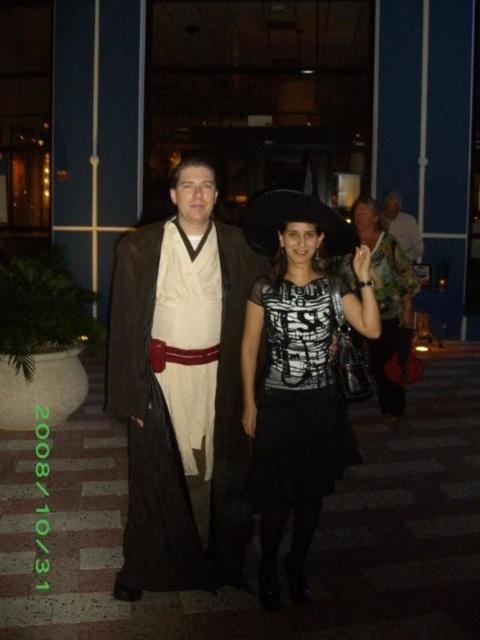
Who is taller, black mesh dress at center or white fabric shirt at center?

Standing taller between the two is black mesh dress at center.

Is point (273, 330) positioned in front of point (419, 241)?

Yes, it is in front of point (419, 241).

This screenshot has width=480, height=640. Identify the location of black mesh dress at center. (299, 396).

Does brown matte robe at center have a lesser height compared to black matte dress at center?

In fact, brown matte robe at center may be taller than black matte dress at center.

The width and height of the screenshot is (480, 640). What do you see at coordinates (180, 388) in the screenshot?
I see `brown matte robe at center` at bounding box center [180, 388].

This screenshot has width=480, height=640. I want to click on brown matte robe at center, so click(x=180, y=388).

Which is behind, point (263, 472) or point (282, 413)?

Point (263, 472)

Which is above, black matte dress at center or black mesh dress at center?

Positioned higher is black mesh dress at center.

The height and width of the screenshot is (640, 480). What do you see at coordinates (299, 376) in the screenshot?
I see `black matte dress at center` at bounding box center [299, 376].

I want to click on black matte dress at center, so click(x=299, y=376).